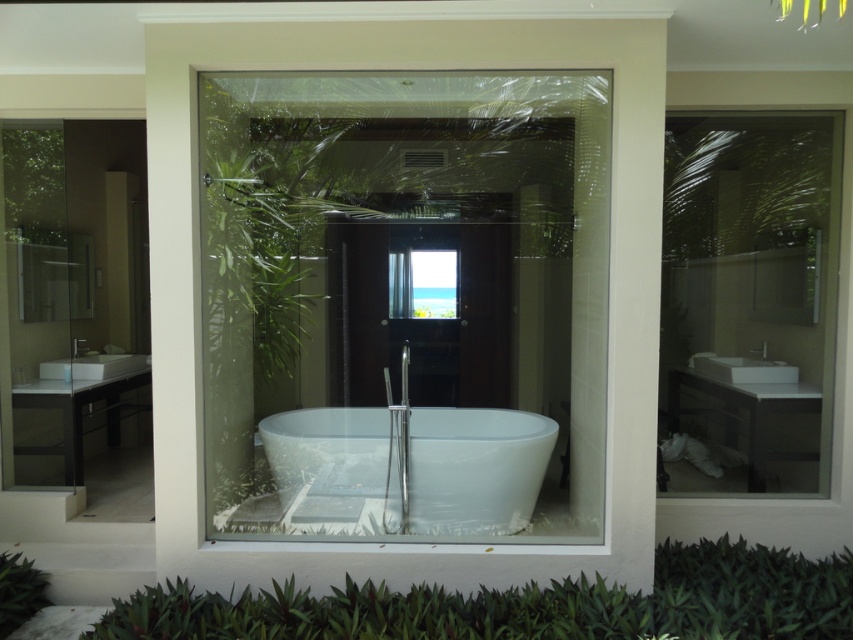
Who is positioned more to the left, transparent glass door at center or white ceramic sink at center?

transparent glass door at center is more to the left.

Does point (418, 376) lie in front of point (734, 365)?

No, it is not.

The image size is (853, 640). Find the location of `transparent glass door at center`. transparent glass door at center is located at coordinates (421, 317).

Can you confirm if transparent glass bathtub at center is wider than white ceramic sink at center?

Yes, transparent glass bathtub at center is wider than white ceramic sink at center.

Between point (498, 170) and point (724, 360), which one is positioned in front?

Point (724, 360) is more forward.

The image size is (853, 640). I want to click on transparent glass bathtub at center, so click(x=403, y=301).

Can you confirm if white glossy bathtub at center is positioned to the left of transparent glass door at center?

In fact, white glossy bathtub at center is to the right of transparent glass door at center.

Who is more forward, (357, 520) or (370, 228)?

Point (357, 520) is more forward.

Does point (305, 456) come behind point (428, 332)?

That is False.

The width and height of the screenshot is (853, 640). I want to click on white glossy bathtub at center, so click(474, 468).